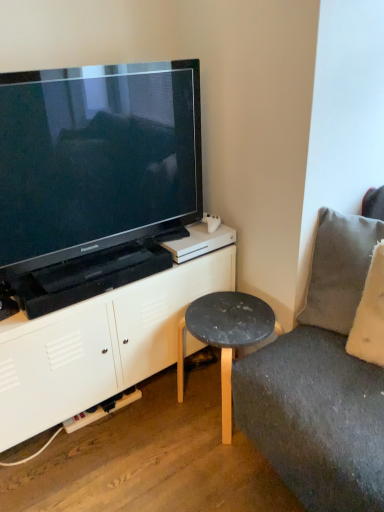
Question: Does gray fabric pillow at right have a smaller size compared to white matte cabinet at lower left?

Choices:
 (A) no
 (B) yes

Answer: (B)

Question: Considering the relative sizes of gray fabric pillow at right and white matte cabinet at lower left in the image provided, is gray fabric pillow at right shorter than white matte cabinet at lower left?

Choices:
 (A) yes
 (B) no

Answer: (A)

Question: Is gray fabric pillow at right placed right next to white matte cabinet at lower left?

Choices:
 (A) no
 (B) yes

Answer: (A)

Question: Is gray fabric pillow at right positioned with its back to white matte cabinet at lower left?

Choices:
 (A) no
 (B) yes

Answer: (A)

Question: From a real-world perspective, is gray fabric pillow at right physically below white matte cabinet at lower left?

Choices:
 (A) yes
 (B) no

Answer: (B)

Question: Does gray fabric pillow at right appear on the right side of white matte cabinet at lower left?

Choices:
 (A) yes
 (B) no

Answer: (A)

Question: Is black glossy television at upper left closer to the viewer compared to matte black stool at lower center?

Choices:
 (A) yes
 (B) no

Answer: (A)

Question: Is black glossy television at upper left not within matte black stool at lower center?

Choices:
 (A) no
 (B) yes

Answer: (B)

Question: Is black glossy television at upper left to the right of matte black stool at lower center from the viewer's perspective?

Choices:
 (A) yes
 (B) no

Answer: (B)

Question: Would you say matte black stool at lower center is part of black glossy television at upper left's contents?

Choices:
 (A) yes
 (B) no

Answer: (B)

Question: Is black glossy television at upper left facing towards matte black stool at lower center?

Choices:
 (A) no
 (B) yes

Answer: (A)

Question: From a real-world perspective, is black glossy television at upper left physically below matte black stool at lower center?

Choices:
 (A) yes
 (B) no

Answer: (B)

Question: From the image's perspective, would you say gray fabric pillow at right is positioned over matte black stool at lower center?

Choices:
 (A) no
 (B) yes

Answer: (B)